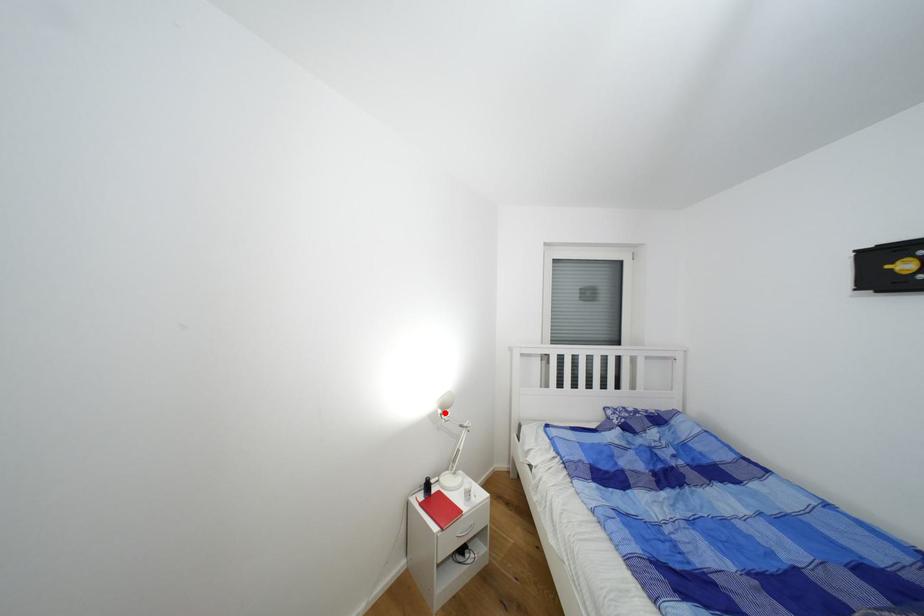
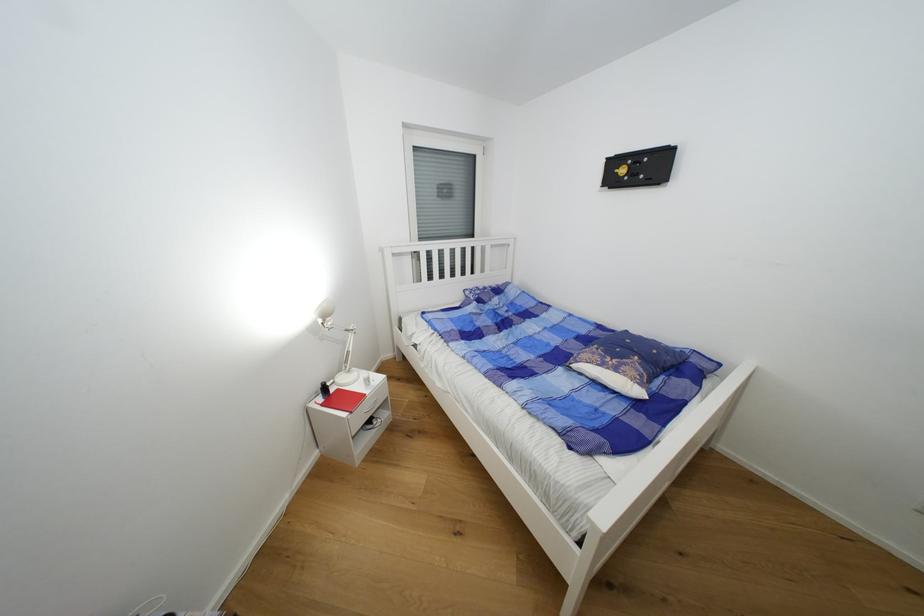
Question: I am providing you with two images of the same scene from different viewpoints. In image1, a red point is highlighted. Considering the same 3D point in image2, which of the following is correct?

Choices:
 (A) It is closer
 (B) It is farther

Answer: (A)